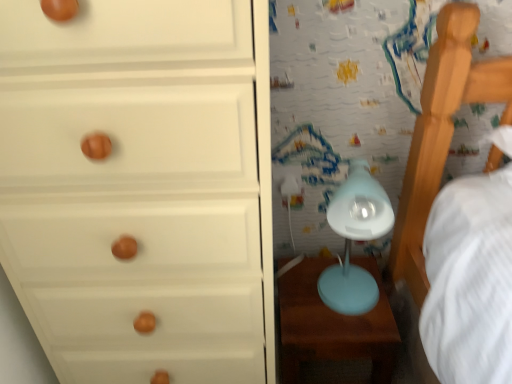
Question: Should I look upward or downward to see white matte chest of drawers at left?

Choices:
 (A) up
 (B) down

Answer: (B)

Question: Could you tell me if matte blue table at lower right is facing matte blue table lamp at center-right?

Choices:
 (A) no
 (B) yes

Answer: (A)

Question: From a real-world perspective, does matte blue table at lower right stand above matte blue table lamp at center-right?

Choices:
 (A) yes
 (B) no

Answer: (B)

Question: From the image's perspective, is matte blue table at lower right on top of matte blue table lamp at center-right?

Choices:
 (A) no
 (B) yes

Answer: (A)

Question: Considering the relative sizes of matte blue table at lower right and matte blue table lamp at center-right in the image provided, is matte blue table at lower right wider than matte blue table lamp at center-right?

Choices:
 (A) yes
 (B) no

Answer: (A)

Question: Does matte blue table at lower right have a greater height compared to matte blue table lamp at center-right?

Choices:
 (A) no
 (B) yes

Answer: (A)

Question: Can you confirm if matte blue table at lower right is positioned to the left of matte blue table lamp at center-right?

Choices:
 (A) no
 (B) yes

Answer: (B)

Question: Is the depth of white matte chest of drawers at left less than that of matte blue table lamp at center-right?

Choices:
 (A) no
 (B) yes

Answer: (B)

Question: Considering the relative sizes of white matte chest of drawers at left and matte blue table lamp at center-right in the image provided, is white matte chest of drawers at left shorter than matte blue table lamp at center-right?

Choices:
 (A) yes
 (B) no

Answer: (B)

Question: Is white matte chest of drawers at left at the left side of matte blue table lamp at center-right?

Choices:
 (A) no
 (B) yes

Answer: (B)

Question: From the image's perspective, would you say white matte chest of drawers at left is positioned over matte blue table lamp at center-right?

Choices:
 (A) no
 (B) yes

Answer: (A)

Question: Are white matte chest of drawers at left and matte blue table lamp at center-right making contact?

Choices:
 (A) yes
 (B) no

Answer: (B)

Question: Would you say matte blue table lamp at center-right is part of white matte chest of drawers at left's contents?

Choices:
 (A) no
 (B) yes

Answer: (A)

Question: Can you confirm if white matte chest of drawers at left is smaller than matte blue table at lower right?

Choices:
 (A) no
 (B) yes

Answer: (A)